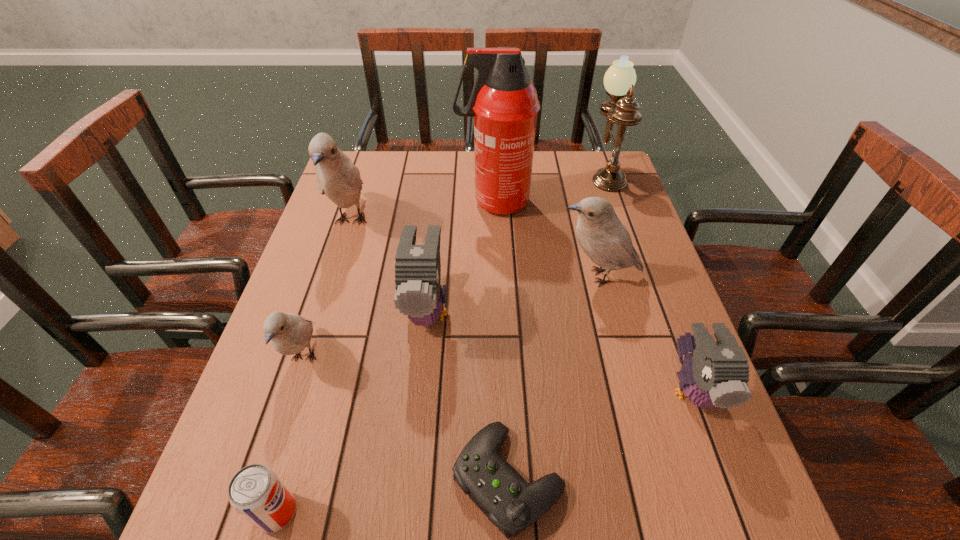
Identify the location of the tallest object. (504, 103).

Where is `fire extinguisher`? The width and height of the screenshot is (960, 540). fire extinguisher is located at coordinates (504, 103).

Locate an element on the screen. oil lamp is located at coordinates (619, 80).

Locate an element on the screen. the tallest bird is located at coordinates (337, 177).

The image size is (960, 540). I want to click on the farthest white bird, so pyautogui.click(x=337, y=177).

Find the location of a particular element. the second nearest white bird is located at coordinates (602, 236).

The image size is (960, 540). I want to click on the rightmost white bird, so click(602, 236).

This screenshot has width=960, height=540. Find the location of `the third bird from right to left`. the third bird from right to left is located at coordinates (419, 295).

Image resolution: width=960 pixels, height=540 pixels. I want to click on the left gray bird, so click(419, 295).

The width and height of the screenshot is (960, 540). Identify the location of the smallest white bird. (290, 334).